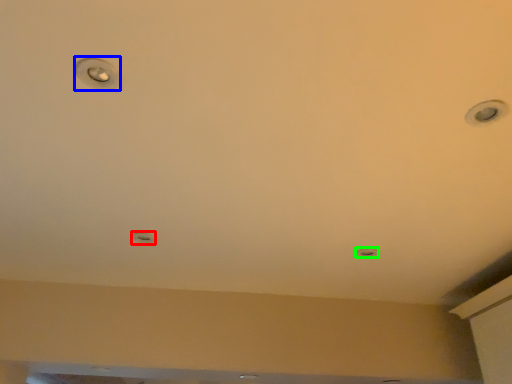
Question: Which object is positioned closest to droplight (highlighted by a red box)? Select from droplight (highlighted by a blue box) and light (highlighted by a green box).

Choices:
 (A) droplight
 (B) light

Answer: (A)